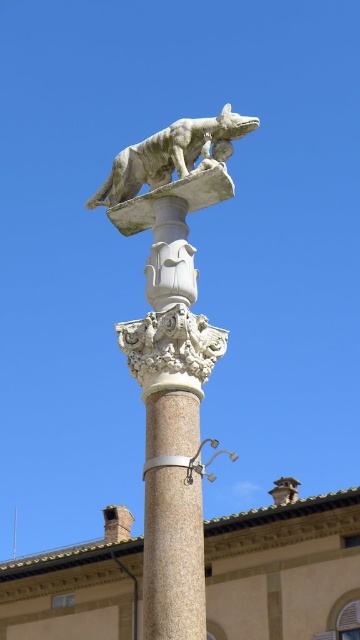
Question: Does white marble wolf at upper center have a larger size compared to metallic silver lamp post at center?

Choices:
 (A) no
 (B) yes

Answer: (B)

Question: Among these objects, which one is nearest to the camera?

Choices:
 (A) white marble wolf at upper center
 (B) granite column at center
 (C) metallic silver lamp post at center

Answer: (B)

Question: In this image, where is white marble wolf at upper center located relative to granite column at center?

Choices:
 (A) right
 (B) left

Answer: (B)

Question: Estimate the real-world distances between objects in this image. Which object is closer to the gray stone wolf at upper center?

Choices:
 (A) white marble wolf at upper center
 (B) metallic silver lamp post at center

Answer: (A)

Question: Which object is the closest to the metallic silver lamp post at center?

Choices:
 (A) gray stone wolf at upper center
 (B) white marble wolf at upper center

Answer: (B)

Question: Is granite column at center smaller than metallic silver lamp post at center?

Choices:
 (A) no
 (B) yes

Answer: (B)